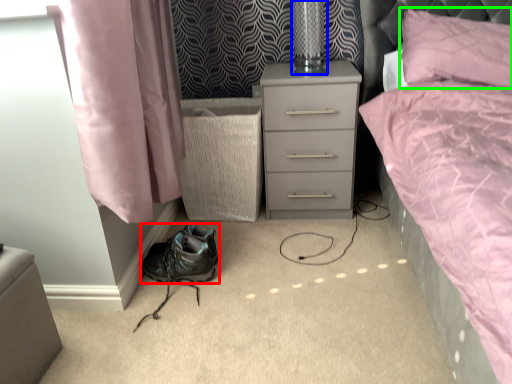
Question: Which is nearer to the shoe (highlighted by a red box)? table lamp (highlighted by a blue box) or pillow (highlighted by a green box).

Choices:
 (A) table lamp
 (B) pillow

Answer: (A)